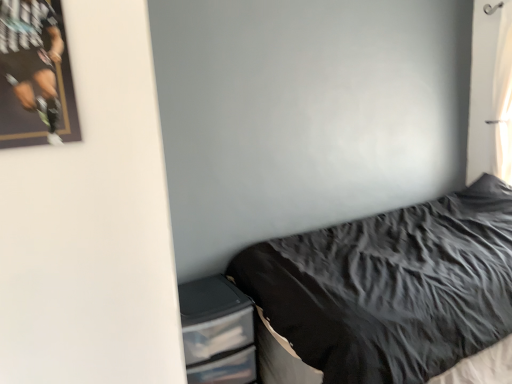
Question: Is black textured fabric at lower right in front of or behind matte black poster at upper left in the image?

Choices:
 (A) front
 (B) behind

Answer: (B)

Question: From the image's perspective, is black textured fabric at lower right positioned above or below matte black poster at upper left?

Choices:
 (A) below
 (B) above

Answer: (A)

Question: Estimate the real-world distances between objects in this image. Which object is closer to the black textured fabric at lower right?

Choices:
 (A) matte black poster at upper left
 (B) clear plastic drawers at lower left
 (C) white sheer curtain at upper right

Answer: (B)

Question: Estimate the real-world distances between objects in this image. Which object is farther from the clear plastic drawers at lower left?

Choices:
 (A) white sheer curtain at upper right
 (B) black textured fabric at lower right
 (C) matte black poster at upper left

Answer: (A)